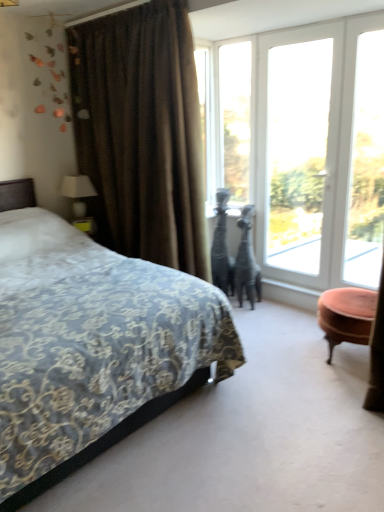
Locate an element on the screen. This screenshot has height=512, width=384. vacant area situated to the left side of velvet pink ottoman at right is located at coordinates (283, 354).